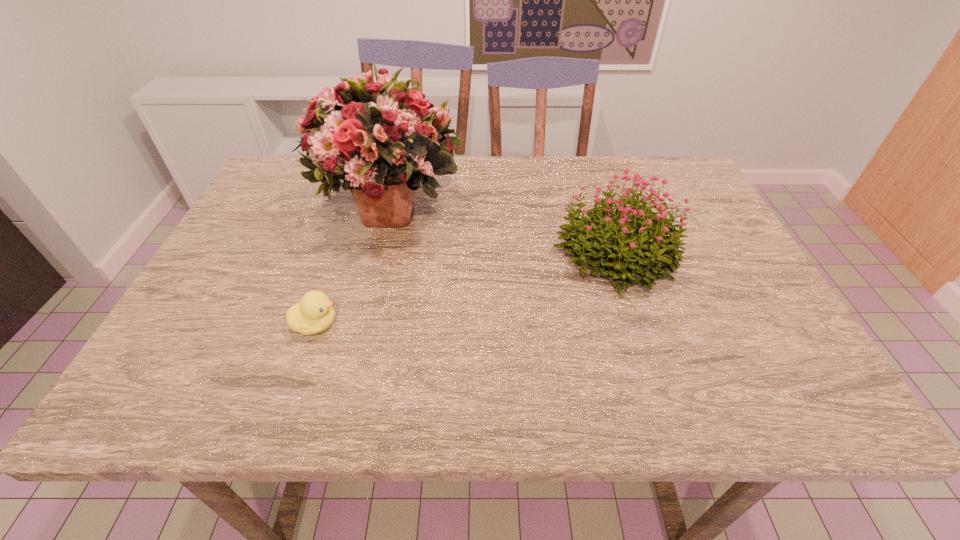
Where is `vacant point located between the shortest object and the tallest object`? The image size is (960, 540). vacant point located between the shortest object and the tallest object is located at coordinates point(352,265).

You are a GUI agent. You are given a task and a screenshot of the screen. Output one action in this format:
    pyautogui.click(x=<x>, y=<y>)
    Task: Click on the unoccupied position between the nearest object and the rightmost object
    The width and height of the screenshot is (960, 540).
    Given the screenshot: What is the action you would take?
    pyautogui.click(x=465, y=289)

Where is `free area in between the right bouquet and the tallest object`? free area in between the right bouquet and the tallest object is located at coordinates (502, 230).

I want to click on unoccupied area between the left bouquet and the duckling, so [352, 265].

Locate an element on the screen. The width and height of the screenshot is (960, 540). empty space between the second tallest object and the nearest object is located at coordinates (465, 289).

Locate an element on the screen. free space between the shortest object and the shorter bouquet is located at coordinates pyautogui.click(x=465, y=289).

I want to click on free spot between the nearest object and the left bouquet, so click(x=352, y=265).

Identify the location of the second closest object to the right bouquet. (314, 313).

Select which object appears as the second closest to the left bouquet. Please provide its 2D coordinates. Your answer should be formatted as a tuple, i.e. [(x, y)], where the tuple contains the x and y coordinates of a point satisfying the conditions above.

[(635, 246)]

Find the location of a particular element. The height and width of the screenshot is (540, 960). free spot that satisfies the following two spatial constraints: 1. on the front side of the rightmost object; 2. on the left side of the left bouquet is located at coordinates (378, 253).